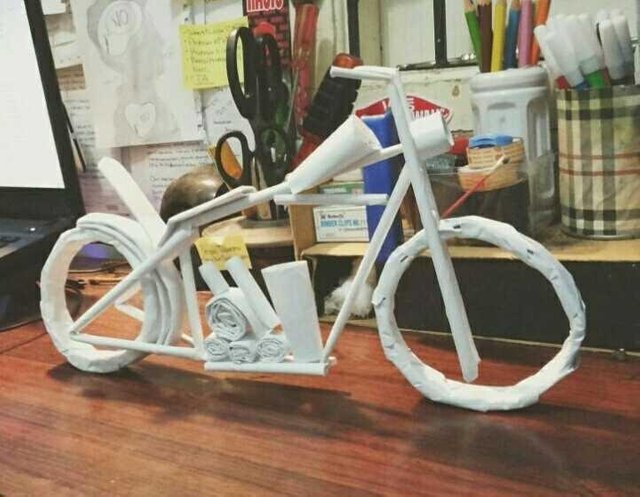
Where is `table`? The width and height of the screenshot is (640, 497). table is located at coordinates (241, 467).